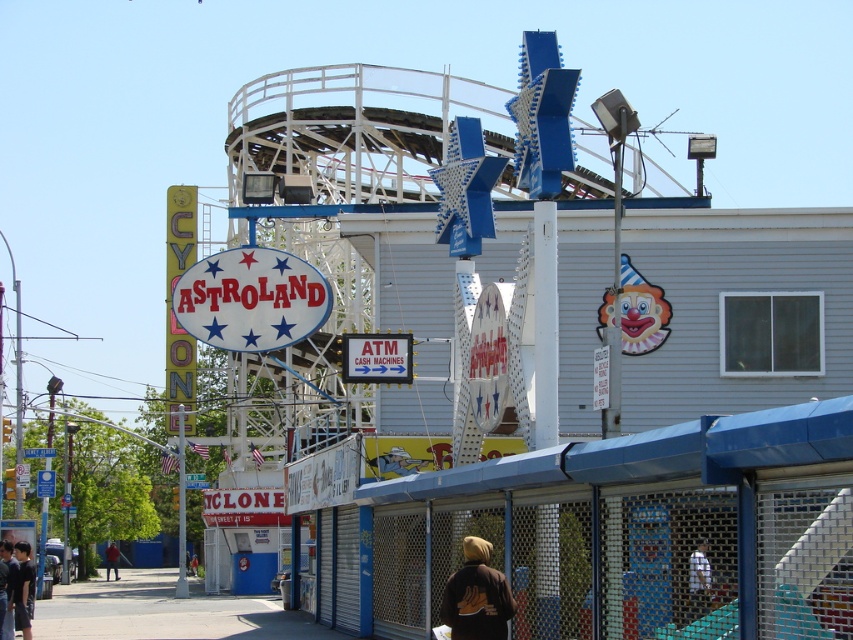
Question: Is white fabric shirt at lower right positioned at the back of red shirt at lower left?

Choices:
 (A) yes
 (B) no

Answer: (B)

Question: From the image, what is the correct spatial relationship of brown fleece jacket at lower center in relation to dark brown leather jacket at lower left?

Choices:
 (A) left
 (B) right

Answer: (B)

Question: Does brown fleece jacket at lower center appear over white fabric shirt at lower right?

Choices:
 (A) no
 (B) yes

Answer: (A)

Question: Which point is closer to the camera?

Choices:
 (A) (709, 570)
 (B) (18, 582)
 (C) (485, 563)
 (D) (114, 544)

Answer: (A)

Question: Which object is positioned farthest from the red shirt at lower left?

Choices:
 (A) dark brown leather jacket at lower left
 (B) white fabric shirt at lower right

Answer: (B)

Question: Which point is closer to the camera?

Choices:
 (A) (108, 572)
 (B) (692, 595)

Answer: (B)